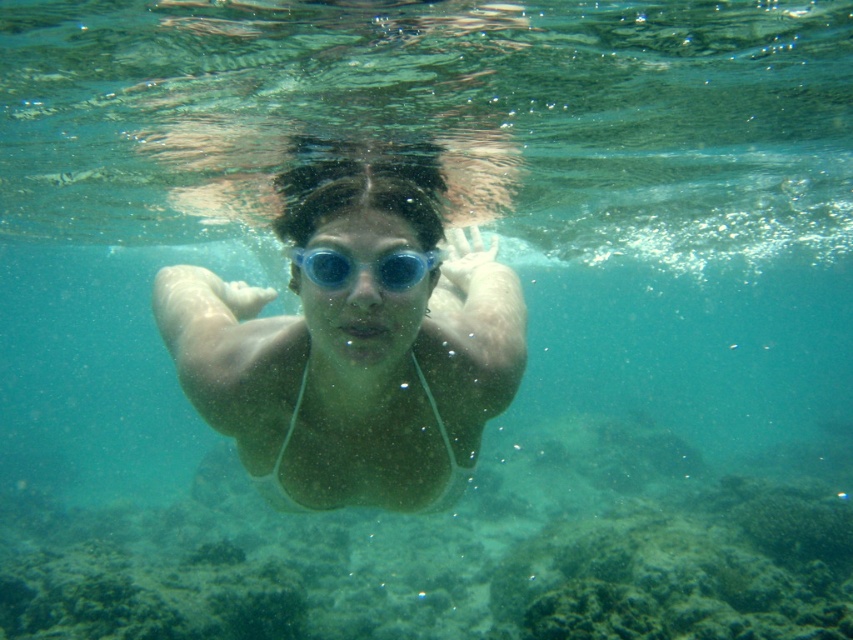
Between point (190, 304) and point (425, 272), which one is positioned behind?

Point (190, 304)

Which is below, matte blue goggles at center or blue translucent goggles at center?

matte blue goggles at center

Locate an element on the screen. Image resolution: width=853 pixels, height=640 pixels. matte blue goggles at center is located at coordinates (354, 342).